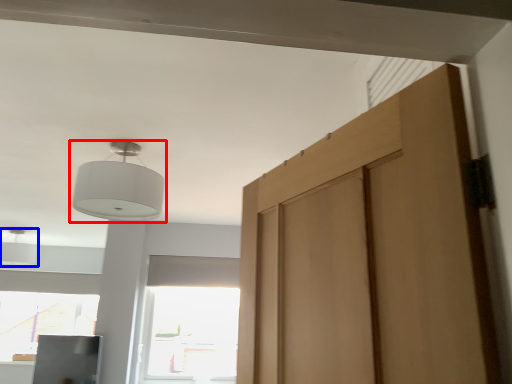
Question: Among these objects, which one is nearest to the camera, lamp (highlighted by a red box) or light (highlighted by a blue box)?

Choices:
 (A) lamp
 (B) light

Answer: (A)